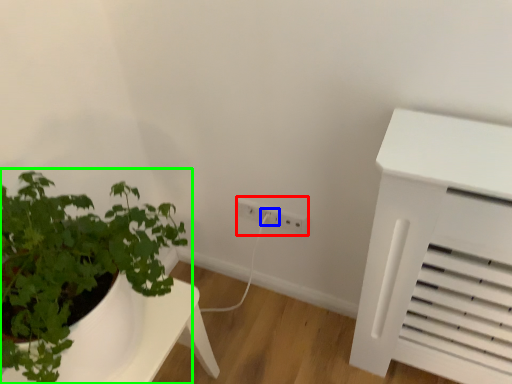
Question: Considering the real-world distances, which object is closest to electric outlet (highlighted by a red box)? electric outlet (highlighted by a blue box) or houseplant (highlighted by a green box).

Choices:
 (A) electric outlet
 (B) houseplant

Answer: (A)